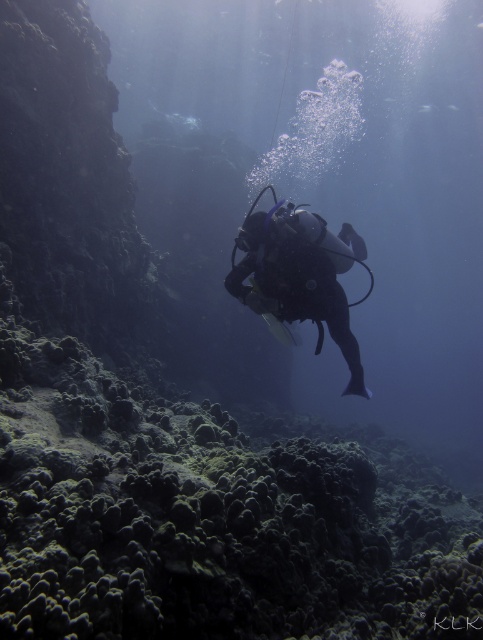
Is green textured coral reef at center wider than matte black scuba diver at center?

Indeed, green textured coral reef at center has a greater width compared to matte black scuba diver at center.

Does green textured coral reef at center appear on the left side of matte black scuba diver at center?

Yes, green textured coral reef at center is to the left of matte black scuba diver at center.

What do you see at coordinates (208, 518) in the screenshot?
I see `green textured coral reef at center` at bounding box center [208, 518].

Locate an element on the screen. Image resolution: width=483 pixels, height=640 pixels. green textured coral reef at center is located at coordinates (208, 518).